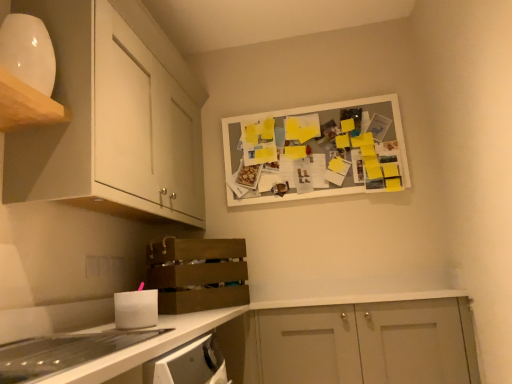
Question: From the image's perspective, does white matte cabinet doors at lower right, placed as the first cabinetry when sorted from right to left, appear higher than brown wooden crate at lower left?

Choices:
 (A) yes
 (B) no

Answer: (B)

Question: From a real-world perspective, is white matte cabinet doors at lower right, arranged as the 1th cabinetry when ordered from the bottom, on top of brown wooden crate at lower left?

Choices:
 (A) yes
 (B) no

Answer: (B)

Question: Would you say white matte cabinet doors at lower right, the third cabinetry from the left, is outside brown wooden crate at lower left?

Choices:
 (A) yes
 (B) no

Answer: (A)

Question: Is white matte cabinet doors at lower right, the third cabinetry from the left, positioned before brown wooden crate at lower left?

Choices:
 (A) yes
 (B) no

Answer: (B)

Question: Is white matte cabinet doors at lower right, placed as the first cabinetry when sorted from right to left, to the left of brown wooden crate at lower left from the viewer's perspective?

Choices:
 (A) no
 (B) yes

Answer: (A)

Question: From a real-world perspective, is white glossy cabinet at upper left, the 1th cabinetry when ordered from left to right, positioned above or below brown wooden crate at lower left?

Choices:
 (A) above
 (B) below

Answer: (A)

Question: Looking at their shapes, would you say white glossy cabinet at upper left, marked as the 3th cabinetry in a right-to-left arrangement, is wider or thinner than brown wooden crate at lower left?

Choices:
 (A) wide
 (B) thin

Answer: (B)

Question: In terms of height, does white glossy cabinet at upper left, positioned as the first cabinetry in top-to-bottom order, look taller or shorter compared to brown wooden crate at lower left?

Choices:
 (A) tall
 (B) short

Answer: (B)

Question: Is white glossy cabinet at upper left, the 1th cabinetry when ordered from left to right, spatially inside brown wooden crate at lower left, or outside of it?

Choices:
 (A) outside
 (B) inside

Answer: (A)

Question: Based on their sizes in the image, would you say white matte bulletin board at upper center is bigger or smaller than white matte cabinet at upper left, positioned as the 2th cabinetry in right-to-left order?

Choices:
 (A) big
 (B) small

Answer: (B)

Question: Considering their positions, is white matte bulletin board at upper center located in front of or behind white matte cabinet at upper left, positioned as the 2th cabinetry in right-to-left order?

Choices:
 (A) behind
 (B) front

Answer: (A)

Question: Based on their positions, is white matte bulletin board at upper center located to the left or right of white matte cabinet at upper left, positioned as the 2th cabinetry in right-to-left order?

Choices:
 (A) left
 (B) right

Answer: (B)

Question: Is white matte bulletin board at upper center wider or thinner than white matte cabinet at upper left, the second cabinetry in the left-to-right sequence?

Choices:
 (A) wide
 (B) thin

Answer: (B)

Question: In terms of height, does clear plastic drawer at lower left look taller or shorter compared to brown wooden crate at lower left?

Choices:
 (A) short
 (B) tall

Answer: (A)

Question: Is point (25, 355) closer or farther from the camera than point (177, 259)?

Choices:
 (A) farther
 (B) closer

Answer: (B)